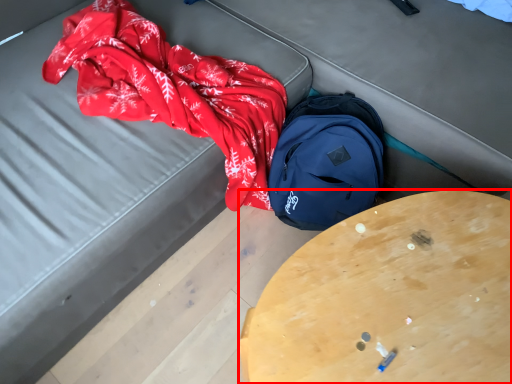
Question: Considering the relative positions of table (annotated by the red box) and backpack in the image provided, where is table (annotated by the red box) located with respect to the staircase?

Choices:
 (A) left
 (B) right

Answer: (B)